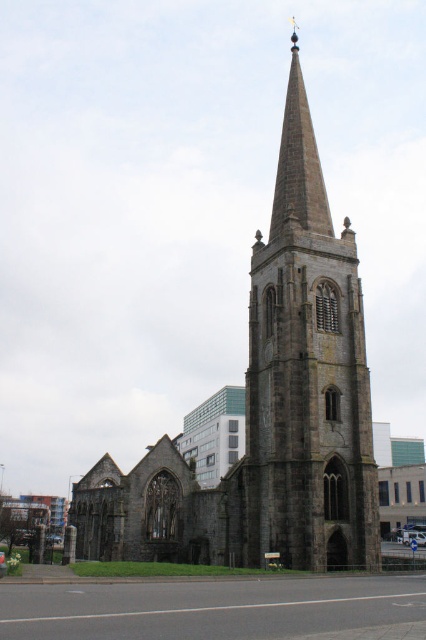
Question: Does dark gray stone church at center lie behind dark gray stone tower at center?

Choices:
 (A) yes
 (B) no

Answer: (A)

Question: Where is dark gray stone church at center located in relation to dark gray stone tower at center in the image?

Choices:
 (A) left
 (B) right

Answer: (A)

Question: Is dark gray stone church at center wider than dark gray stone tower at center?

Choices:
 (A) yes
 (B) no

Answer: (A)

Question: Which point appears closest to the camera in this image?

Choices:
 (A) (307, 310)
 (B) (276, 252)

Answer: (A)

Question: Which object is farther from the camera taking this photo?

Choices:
 (A) dark gray stone church at center
 (B) dark gray stone tower at center

Answer: (A)